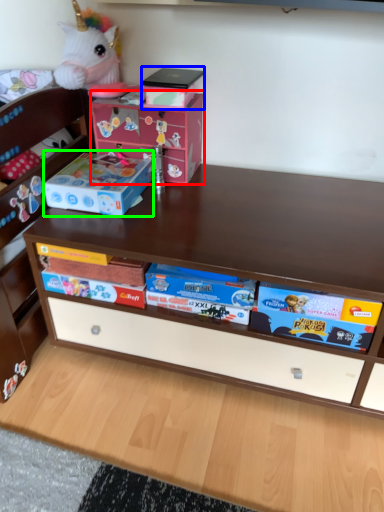
Question: Which is farther away from cardboard box (highlighted by a red box)? box (highlighted by a blue box) or storage box (highlighted by a green box)?

Choices:
 (A) box
 (B) storage box

Answer: (B)